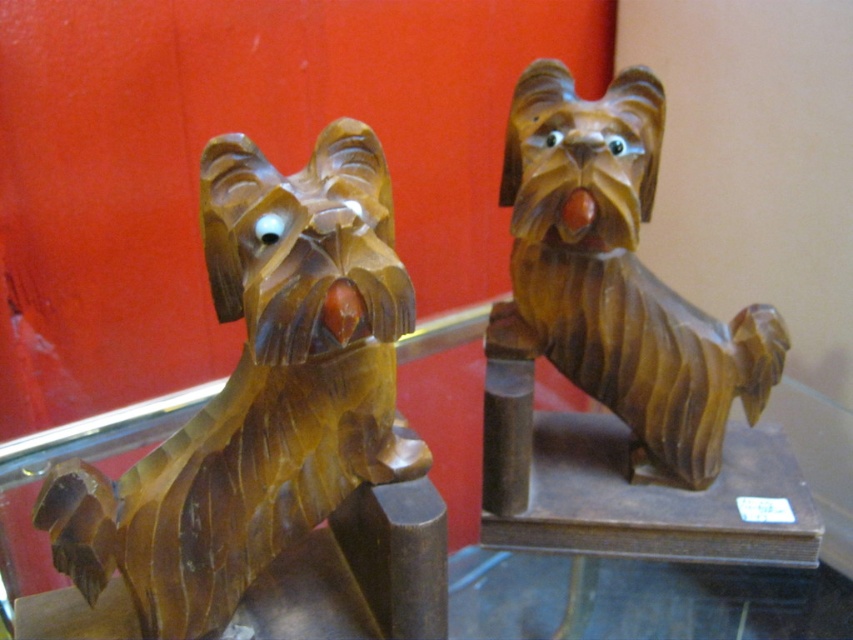
Based on the photo, you are an art curator arranging the two wooden dog sculptures on a glass shelf. The wooden dog at left and the wooden dog at right must be positioned according to their original placement. If you want to place a small decorative item between them, where should you place it?

The wooden dog at left is located below the wooden dog at right, so you should place the decorative item between them in the space between the lower wooden dog at left and the higher wooden dog at right.

You are an art curator examining two wooden dog sculptures on a glass shelf. The wooden dog at left and the wooden dog at right are both displayed. Which sculpture has a greater width?

The wooden dog at left has a greater width than the wooden dog at right.

You are an art curator examining two wooden dog sculptures displayed on a glass shelf. The wooden dog at left and the wooden dog at right are both on display. Based on their sizes, which sculpture would require a larger base to remain stable?

The wooden dog at left requires a larger base because it is larger in size compared to the wooden dog at right, necessitating a more substantial foundation for stability.